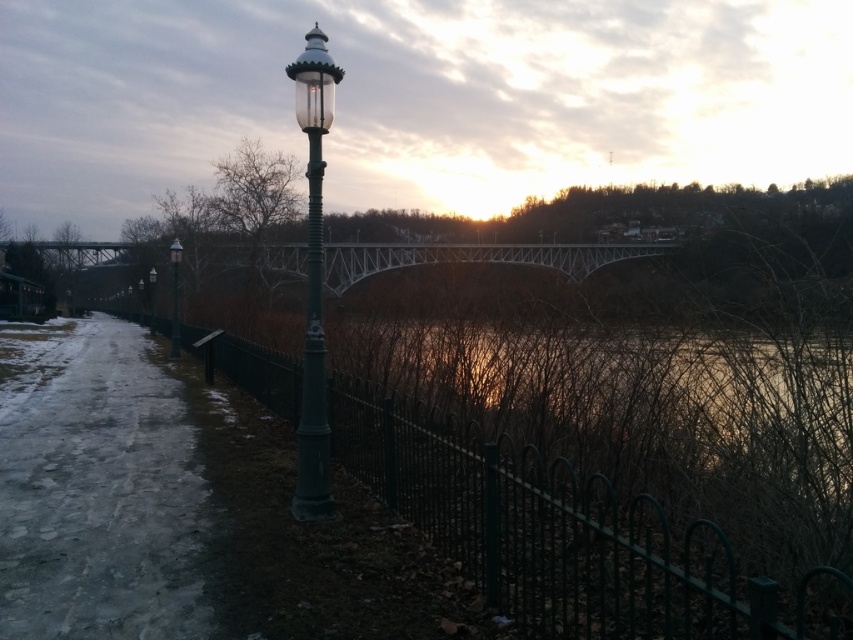
Does icy concrete path at lower left have a greater width compared to green glass street light at left?

Correct, the width of icy concrete path at lower left exceeds that of green glass street light at left.

Which is more to the right, icy concrete path at lower left or green glass street light at left?

From the viewer's perspective, icy concrete path at lower left appears more on the right side.

Is point (151, 461) positioned behind point (172, 259)?

No, (151, 461) is closer to viewer.

The height and width of the screenshot is (640, 853). Identify the location of icy concrete path at lower left. (102, 499).

How distant is green wrought iron fence at center from white metallic bridge at center?

green wrought iron fence at center is 12.82 meters away from white metallic bridge at center.

Is point (593, 579) positioned before point (380, 262)?

That is True.

Who is more distant from viewer, (813, 612) or (434, 250)?

Positioned behind is point (434, 250).

Where is `green wrought iron fence at center`? The width and height of the screenshot is (853, 640). green wrought iron fence at center is located at coordinates (566, 536).

Is green matte lamp post at center wider than matte green pole at center?

Incorrect, green matte lamp post at center's width does not surpass matte green pole at center's.

Who is shorter, green matte lamp post at center or matte green pole at center?

green matte lamp post at center

Where is `green matte lamp post at center`? The width and height of the screenshot is (853, 640). green matte lamp post at center is located at coordinates (312, 280).